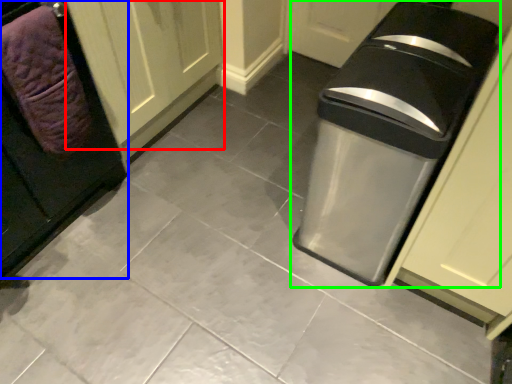
Question: Considering the real-world distances, which object is farthest from door (highlighted by a red box)? cabinetry (highlighted by a blue box) or waste container (highlighted by a green box)?

Choices:
 (A) cabinetry
 (B) waste container

Answer: (B)